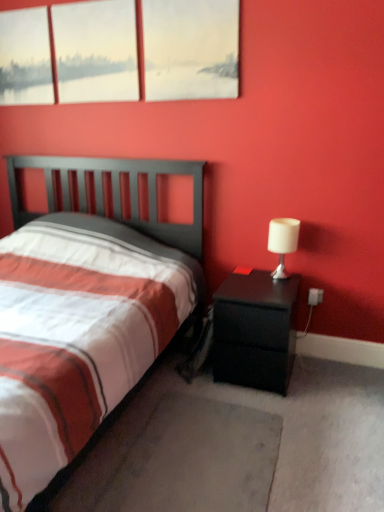
Image resolution: width=384 pixels, height=512 pixels. What are the coordinates of `spots to the right of gray carpet at lower center` in the screenshot? It's located at (323, 456).